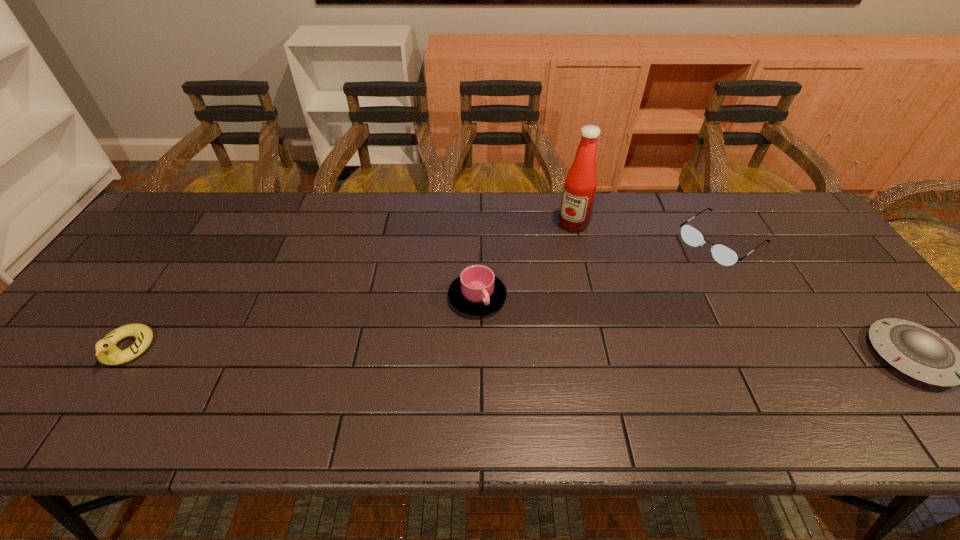
This screenshot has height=540, width=960. I want to click on vacant space positioned on the side with the handle of the fourth object from right to left, so 558,374.

Where is `vacant point located on the front-facing side of the condiment`? vacant point located on the front-facing side of the condiment is located at coordinates (542, 260).

At what (x,y) coordinates should I click in order to perform the action: click on vacant space situated on the front-facing side of the condiment. Please return your answer as a coordinate pair (x, y). This screenshot has width=960, height=540. Looking at the image, I should click on (516, 292).

At what (x,y) coordinates should I click in order to perform the action: click on free point located on the front-facing side of the condiment. Please return your answer as a coordinate pair (x, y). Image resolution: width=960 pixels, height=540 pixels. Looking at the image, I should click on (505, 304).

Identify the location of free space located on the lenses of the second shortest object. The width and height of the screenshot is (960, 540). (627, 309).

This screenshot has height=540, width=960. What are the coordinates of `free region located on the lenses of the second shortest object` in the screenshot? It's located at (681, 270).

In order to click on blank space located on the lenses of the second shortest object in this screenshot , I will do `click(665, 281)`.

At what (x,y) coordinates should I click in order to perform the action: click on condiment that is positioned at the far edge. Please return your answer as a coordinate pair (x, y). The width and height of the screenshot is (960, 540). Looking at the image, I should click on (580, 185).

Identify the location of spectacles that is at the far edge. Image resolution: width=960 pixels, height=540 pixels. (722, 254).

You are a GUI agent. You are given a task and a screenshot of the screen. Output one action in this format:
    pyautogui.click(x=<x>, y=<y>)
    Task: Click on the object at the near edge
    This screenshot has width=960, height=540.
    Given the screenshot: What is the action you would take?
    pyautogui.click(x=107, y=352)